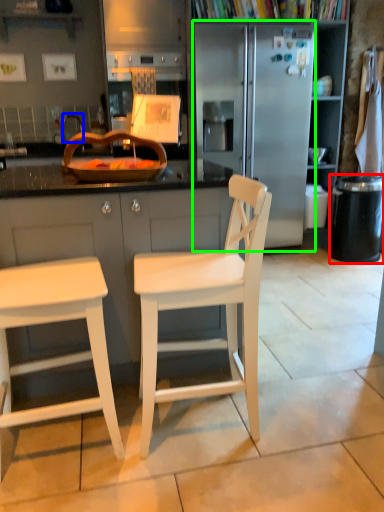
Question: Considering the real-world distances, which object is farthest from trash bin/can (highlighted by a red box)? faucet (highlighted by a blue box) or refrigerator (highlighted by a green box)?

Choices:
 (A) faucet
 (B) refrigerator

Answer: (A)